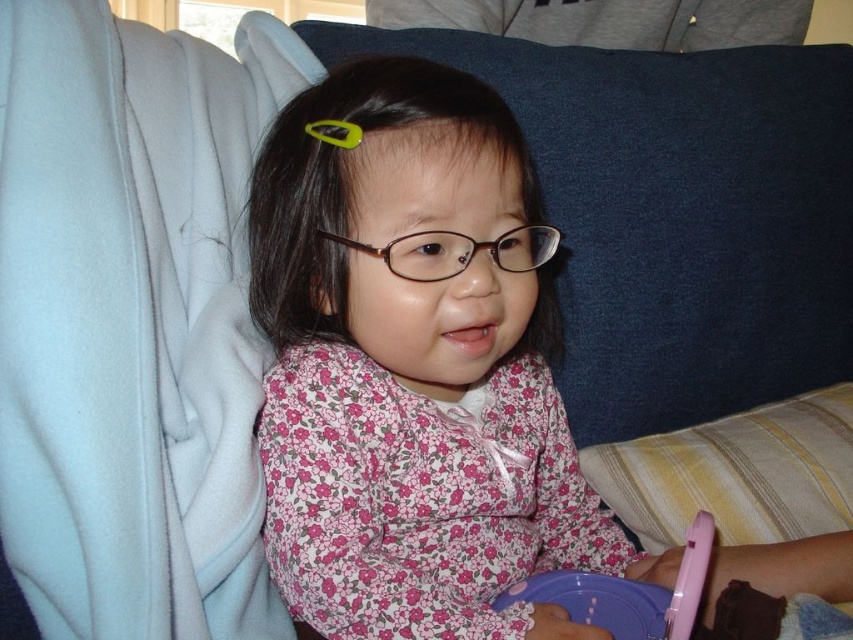
Question: Observing the image, what is the correct spatial positioning of pink floral dress at center in reference to chocolate cake at lower right?

Choices:
 (A) above
 (B) below

Answer: (A)

Question: Is pink floral dress at center smaller than purple plastic paper plate at lower center?

Choices:
 (A) no
 (B) yes

Answer: (A)

Question: Which point is farther to the camera?

Choices:
 (A) purple plastic paper plate at lower center
 (B) pink floral dress at center
 (C) chocolate cake at lower right

Answer: (C)

Question: Which object appears closest to the camera in this image?

Choices:
 (A) chocolate cake at lower right
 (B) pink floral dress at center

Answer: (B)

Question: Which object appears closest to the camera in this image?

Choices:
 (A) pink floral dress at center
 (B) chocolate cake at lower right

Answer: (A)

Question: Is purple plastic paper plate at lower center behind chocolate cake at lower right?

Choices:
 (A) no
 (B) yes

Answer: (A)